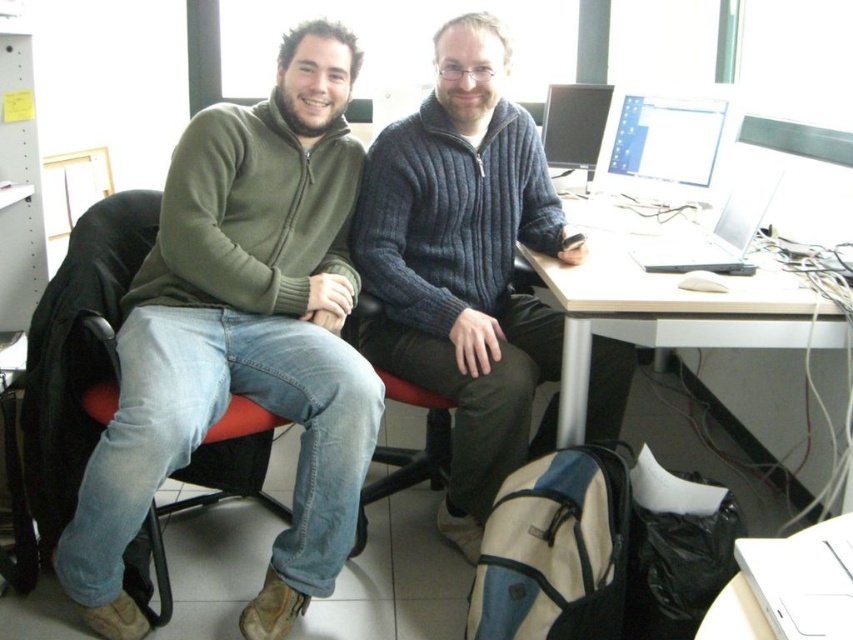
Question: Which of the following is the farthest from the observer?

Choices:
 (A) green matte sweater at left
 (B) matte black monitor at center

Answer: (B)

Question: Does white plastic computer desk at lower right appear on the right side of matte plastic monitor at upper right?

Choices:
 (A) yes
 (B) no

Answer: (B)

Question: Which point is farther to the camera?

Choices:
 (A) white plastic computer desk at lower right
 (B) green matte sweater at left
 (C) matte plastic monitor at upper right

Answer: (C)

Question: Does matte plastic monitor at upper right have a larger size compared to matte black monitor at center?

Choices:
 (A) yes
 (B) no

Answer: (A)

Question: Which of the following is the closest to the observer?

Choices:
 (A) (381, 314)
 (B) (637, 305)
 (C) (573, 122)

Answer: (B)

Question: Does green matte sweater at left have a lesser width compared to red fabric chair at center?

Choices:
 (A) yes
 (B) no

Answer: (B)